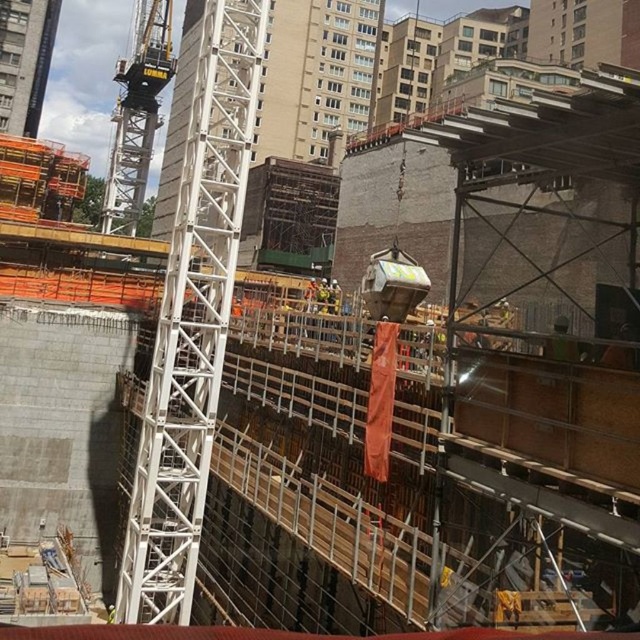
Does white metallic crane at center have a lesser height compared to white metallic crane at upper left?

Indeed, white metallic crane at center has a lesser height compared to white metallic crane at upper left.

The image size is (640, 640). In order to click on white metallic crane at center in this screenshot , I will do [193, 321].

Where is `white metallic crane at center`? white metallic crane at center is located at coordinates (193, 321).

Is point (166, 22) farther from viewer compared to point (17, 134)?

Yes, it is behind point (17, 134).

Does white metallic crane at upper left appear over white metal tower at upper left?

Actually, white metallic crane at upper left is below white metal tower at upper left.

Is point (141, 161) positioned behind point (36, 124)?

No, it is in front of (36, 124).

Locate an element on the screen. Image resolution: width=640 pixels, height=640 pixels. white metallic crane at upper left is located at coordinates (136, 115).

Is point (182, 611) farther from camera compared to point (54, 6)?

No.

Locate an element on the screen. This screenshot has height=640, width=640. white metallic crane at center is located at coordinates (193, 321).